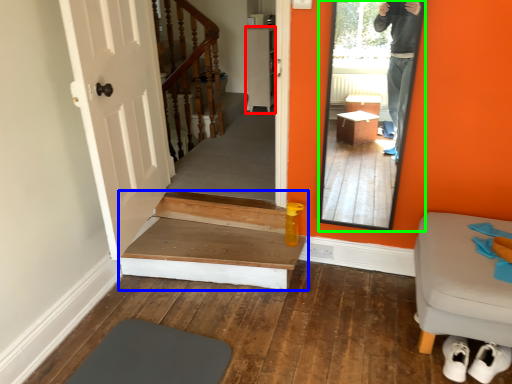
Question: Which object is positioned closest to cabinetry (highlighted by a red box)? Select from stairs (highlighted by a blue box) and mirror (highlighted by a green box).

Choices:
 (A) stairs
 (B) mirror

Answer: (B)